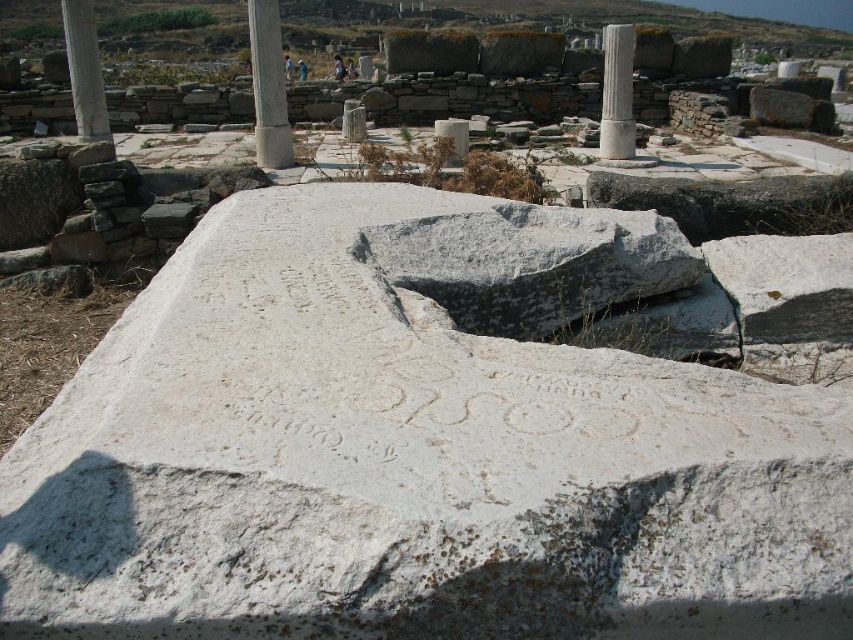
Question: Which of these objects is positioned closest to the white stone column at center?

Choices:
 (A) white stone column at upper left
 (B) white marble column at upper center

Answer: (A)

Question: Does white stone column at center appear under white stone column at upper left?

Choices:
 (A) no
 (B) yes

Answer: (B)

Question: Considering the relative positions of white stone at center and white marble column at upper center in the image provided, where is white stone at center located with respect to white marble column at upper center?

Choices:
 (A) left
 (B) right

Answer: (A)

Question: Which is farther from the white stone column at center?

Choices:
 (A) white marble column at upper center
 (B) white stone at center

Answer: (B)

Question: Is white stone column at center smaller than white marble column at upper center?

Choices:
 (A) yes
 (B) no

Answer: (A)

Question: Based on their relative distances, which object is nearer to the white stone column at upper left?

Choices:
 (A) white stone column at center
 (B) white marble column at upper center
 (C) white stone at center

Answer: (A)